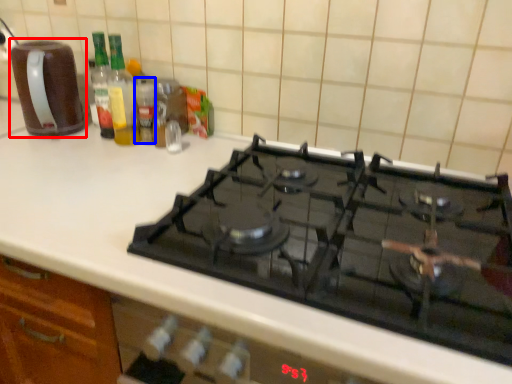
Question: Among these objects, which one is farthest to the camera, kitchen appliance (highlighted by a red box) or bottle (highlighted by a blue box)?

Choices:
 (A) kitchen appliance
 (B) bottle

Answer: (B)